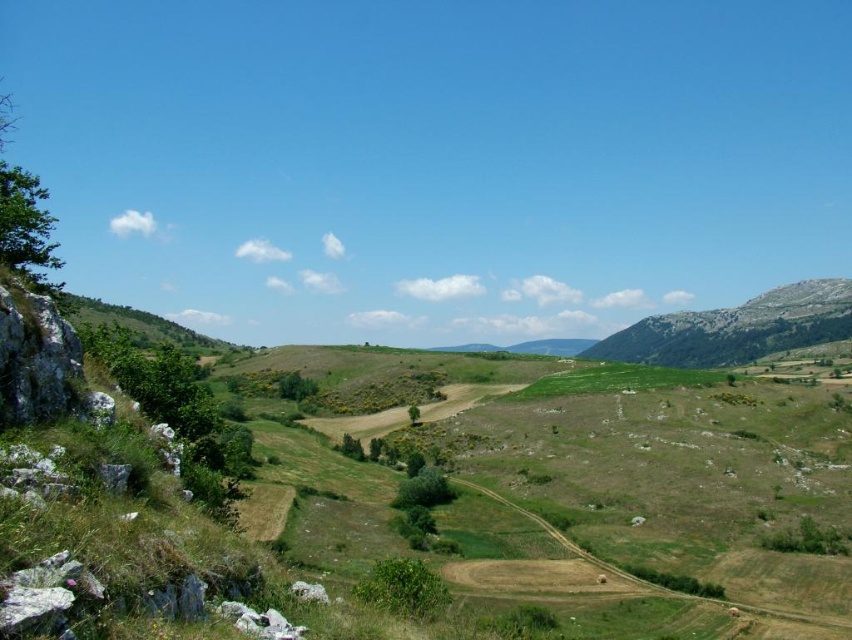
Is the position of green grassy field at center less distant than that of green grassy mountain at right?

That is True.

Image resolution: width=852 pixels, height=640 pixels. Find the location of `green grassy field at center`. green grassy field at center is located at coordinates (106, 456).